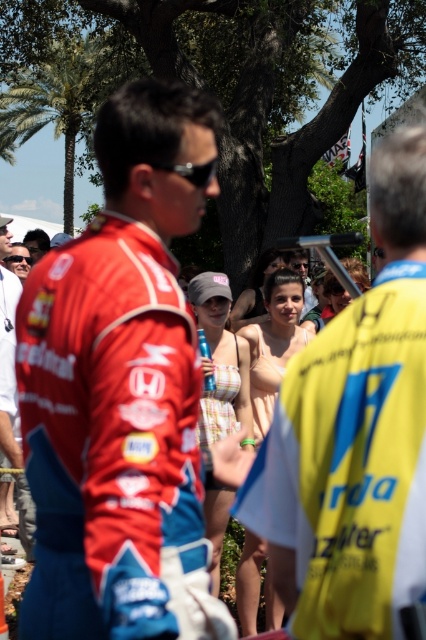
You are a photographer standing at the front of the scene. You want to take a photo that includes both the red fabric racing suit at center and the green leafy palm tree at upper left. Which object should you focus on first to ensure both are in clear focus?

The red fabric racing suit at center is closer to the viewer than the green leafy palm tree at upper left. To ensure both are in clear focus, you should focus on the red fabric racing suit at center first, as it is closer, and the depth of field will naturally include the background object.

You are a photographer at a motorsport event. You need to capture a photo of both the black matte sunglasses at center and the matte black sunglasses at center. Which one is on the right side when viewed from the front?

The black matte sunglasses at center is positioned on the right side of matte black sunglasses at center, so when viewed from the front, the black matte sunglasses at center is on the right side.